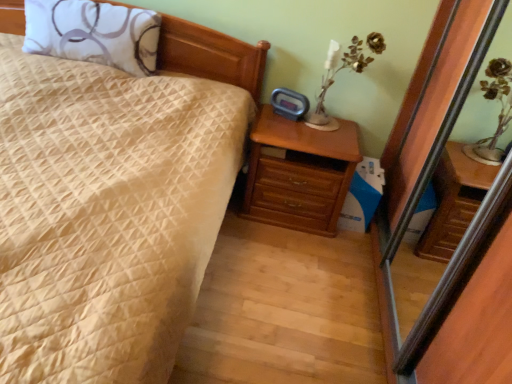
Where is `beige quilted bed at center`? This screenshot has width=512, height=384. beige quilted bed at center is located at coordinates (165, 313).

Where is `transparent glass screen door at right`? The image size is (512, 384). transparent glass screen door at right is located at coordinates (414, 210).

What do you see at coordinates (414, 210) in the screenshot? I see `transparent glass screen door at right` at bounding box center [414, 210].

Where is `beige quilted bed at center`? This screenshot has width=512, height=384. beige quilted bed at center is located at coordinates (165, 313).

Which is more to the right, beige quilted bed at center or transparent glass screen door at right?

Positioned to the right is transparent glass screen door at right.

In the image, is beige quilted bed at center positioned in front of or behind transparent glass screen door at right?

Clearly, beige quilted bed at center is in front of transparent glass screen door at right.

Between beige quilted bed at center and transparent glass screen door at right, which one has larger size?

beige quilted bed at center is bigger.

Consider the image. From the image's perspective, is beige quilted bed at center positioned above or below transparent glass screen door at right?

beige quilted bed at center is above transparent glass screen door at right.

This screenshot has height=384, width=512. Identify the location of pillow on the left of transparent glass screen door at right. (93, 33).

Is white printed pillow at upper left taller or shorter than transparent glass screen door at right?

In the image, white printed pillow at upper left appears to be shorter than transparent glass screen door at right.

Is white printed pillow at upper left spatially inside transparent glass screen door at right, or outside of it?

white printed pillow at upper left is located beyond the bounds of transparent glass screen door at right.

From a real-world perspective, is transparent glass screen door at right below metallic gold flower at upper right?

Yes, from a real-world perspective, transparent glass screen door at right is below metallic gold flower at upper right.

Is transparent glass screen door at right next to metallic gold flower at upper right and touching it?

No, transparent glass screen door at right is not with metallic gold flower at upper right.

Is metallic gold flower at upper right at the back of transparent glass screen door at right?

No, transparent glass screen door at right's orientation is not away from metallic gold flower at upper right.

Is wooden chest of drawers at right spatially inside white printed pillow at upper left, or outside of it?

wooden chest of drawers at right exists outside the volume of white printed pillow at upper left.

Does wooden chest of drawers at right appear on the left side of white printed pillow at upper left?

No.

Considering the relative sizes of wooden chest of drawers at right and white printed pillow at upper left in the image provided, is wooden chest of drawers at right wider than white printed pillow at upper left?

Correct, the width of wooden chest of drawers at right exceeds that of white printed pillow at upper left.

Can you confirm if wooden chest of drawers at right is taller than white printed pillow at upper left?

Yes, wooden chest of drawers at right is taller than white printed pillow at upper left.

From the image's perspective, would you say metallic gold flower at upper right is shown under wooden chest of drawers at right?

Incorrect, from the image's perspective, metallic gold flower at upper right is higher than wooden chest of drawers at right.

What's the angular difference between metallic gold flower at upper right and wooden chest of drawers at right's facing directions?

There is a 0.431-degree angle between the facing directions of metallic gold flower at upper right and wooden chest of drawers at right.

Is metallic gold flower at upper right to the left or to the right of wooden chest of drawers at right in the image?

Based on their positions, metallic gold flower at upper right is located to the right of wooden chest of drawers at right.

Looking at this image, between metallic gold flower at upper right and transparent glass screen door at right, which one is positioned behind?

metallic gold flower at upper right is further from the camera.

From the image's perspective, is metallic gold flower at upper right beneath transparent glass screen door at right?

No, from the image's perspective, metallic gold flower at upper right is not beneath transparent glass screen door at right.

Is metallic gold flower at upper right oriented away from transparent glass screen door at right?

No, metallic gold flower at upper right is not facing the opposite direction of transparent glass screen door at right.

Consider the image. Is metallic gold flower at upper right smaller than transparent glass screen door at right?

Yes.

From a real-world perspective, relative to beige quilted bed at center, is white printed pillow at upper left vertically above or below?

white printed pillow at upper left is situated higher than beige quilted bed at center in the real world.

Does point (155, 52) come farther from viewer compared to point (149, 382)?

Yes, it is.

Looking at this image, can you confirm if white printed pillow at upper left is shorter than beige quilted bed at center?

Yes, white printed pillow at upper left is shorter than beige quilted bed at center.

Where is `screen door behind the beige quilted bed at center`? Image resolution: width=512 pixels, height=384 pixels. screen door behind the beige quilted bed at center is located at coordinates (414, 210).

Locate an element on the screen. Image resolution: width=512 pixels, height=384 pixels. pillow above the transparent glass screen door at right (from the image's perspective) is located at coordinates (93, 33).

Considering their positions, is beige quilted bed at center positioned closer to white printed pillow at upper left than transparent glass screen door at right?

Based on the image, beige quilted bed at center appears to be nearer to white printed pillow at upper left.

Estimate the real-world distances between objects in this image. Which object is closer to transparent glass screen door at right, beige quilted bed at center or metallic gold flower at upper right?

metallic gold flower at upper right is closer to transparent glass screen door at right.

From the image, which object appears to be farther from transparent glass screen door at right, metallic gold flower at upper right or beige quilted bed at center?

beige quilted bed at center lies further to transparent glass screen door at right than the other object.

Based on the photo, based on their spatial positions, is beige quilted bed at center or wooden chest of drawers at right closer to white printed pillow at upper left?

Among the two, beige quilted bed at center is located nearer to white printed pillow at upper left.

Looking at the image, which one is located further to metallic gold flower at upper right, beige quilted bed at center or transparent glass screen door at right?

beige quilted bed at center is positioned further to the anchor metallic gold flower at upper right.

Considering their positions, is transparent glass screen door at right positioned further to white printed pillow at upper left than metallic gold flower at upper right?

transparent glass screen door at right lies further to white printed pillow at upper left than the other object.

Which object lies nearer to the anchor point metallic gold flower at upper right, transparent glass screen door at right or white printed pillow at upper left?

Among the two, transparent glass screen door at right is located nearer to metallic gold flower at upper right.

Considering their positions, is wooden chest of drawers at right positioned further to metallic gold flower at upper right than beige quilted bed at center?

The object further to metallic gold flower at upper right is beige quilted bed at center.

This screenshot has width=512, height=384. I want to click on pillow between beige quilted bed at center and metallic gold flower at upper right from front to back, so click(93, 33).

The image size is (512, 384). Find the location of `chest of drawers between beige quilted bed at center and transparent glass screen door at right`. chest of drawers between beige quilted bed at center and transparent glass screen door at right is located at coordinates (298, 173).

At what (x,y) coordinates should I click in order to perform the action: click on flower between beige quilted bed at center and transparent glass screen door at right from left to right. Please return your answer as a coordinate pair (x, y). Looking at the image, I should click on (376, 42).

I want to click on chest of drawers between transparent glass screen door at right and metallic gold flower at upper right from front to back, so click(298, 173).